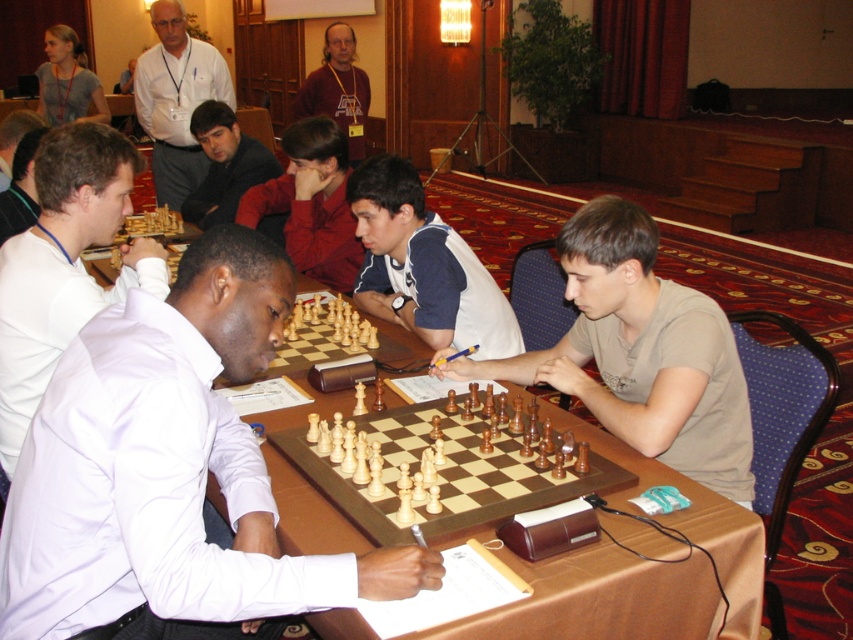
Question: Among these points, which one is nearest to the camera?

Choices:
 (A) (71, 32)
 (B) (480, 426)
 (C) (149, 77)
 (D) (671, 316)

Answer: (D)

Question: Can you confirm if white jersey at center is positioned to the left of matte brown shirt at upper center?

Choices:
 (A) yes
 (B) no

Answer: (B)

Question: Estimate the real-world distances between objects in this image. Which object is farther from the red sweater at center?

Choices:
 (A) white shirt at upper left
 (B) light brown wooden chessboard at center

Answer: (A)

Question: Among these points, which one is farthest from the camera?

Choices:
 (A) (173, 157)
 (B) (293, 272)
 (C) (352, 609)
 (D) (383, 266)

Answer: (A)

Question: Where is white shirt at center located in relation to white shirt at upper left in the image?

Choices:
 (A) below
 (B) above

Answer: (A)

Question: Can you confirm if red sweater at center is smaller than gray fabric shirt at upper left?

Choices:
 (A) yes
 (B) no

Answer: (A)